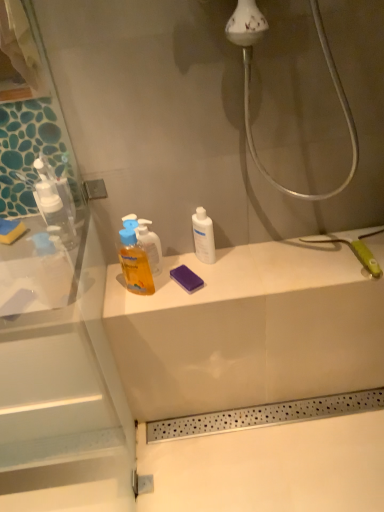
Where is `free space to the right of white matte bottle at center`? The width and height of the screenshot is (384, 512). free space to the right of white matte bottle at center is located at coordinates (256, 260).